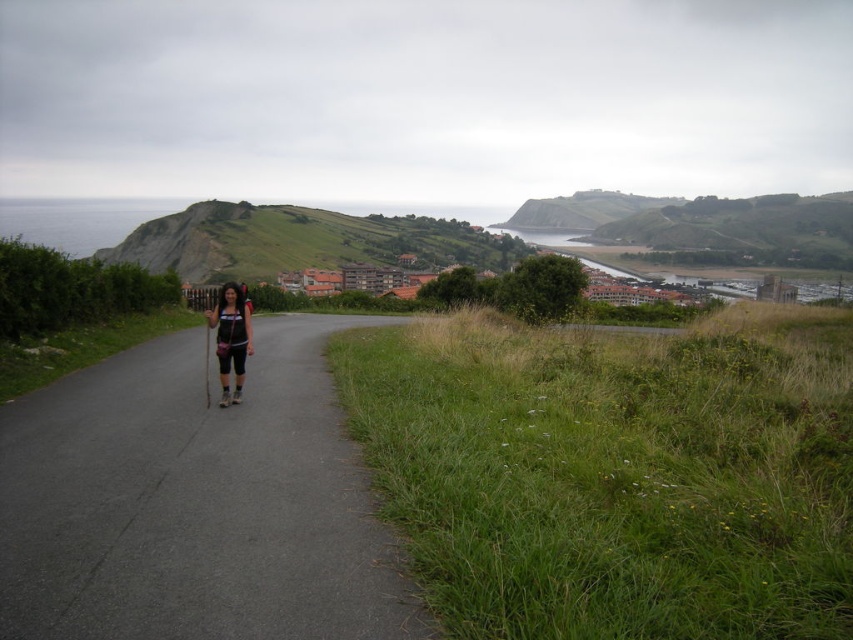
Which is above, green grassy hillside at center or green grassy hillside at upper center?

green grassy hillside at upper center is higher up.

Does green grassy hillside at center have a greater width compared to green grassy hillside at upper center?

Yes, green grassy hillside at center is wider than green grassy hillside at upper center.

Describe the element at coordinates (302, 241) in the screenshot. The width and height of the screenshot is (853, 640). I see `green grassy hillside at center` at that location.

You are a GUI agent. You are given a task and a screenshot of the screen. Output one action in this format:
    pyautogui.click(x=<x>, y=<y>)
    Task: Click on the green grassy hillside at center
    
    Given the screenshot: What is the action you would take?
    pyautogui.click(x=302, y=241)

Is asphalt road at center to the right of matte black shorts at center from the viewer's perspective?

Indeed, asphalt road at center is positioned on the right side of matte black shorts at center.

Between asphalt road at center and matte black shorts at center, which one is positioned lower?

asphalt road at center is lower down.

The image size is (853, 640). Find the location of `asphalt road at center`. asphalt road at center is located at coordinates (195, 502).

The width and height of the screenshot is (853, 640). I want to click on asphalt road at center, so click(195, 502).

Can you confirm if asphalt road at center is positioned to the right of green grassy hillside at upper center?

In fact, asphalt road at center is to the left of green grassy hillside at upper center.

Looking at this image, which of these two, asphalt road at center or green grassy hillside at upper center, stands shorter?

With less height is asphalt road at center.

You are a GUI agent. You are given a task and a screenshot of the screen. Output one action in this format:
    pyautogui.click(x=<x>, y=<y>)
    Task: Click on the asphalt road at center
    Image resolution: width=853 pixels, height=640 pixels.
    Given the screenshot: What is the action you would take?
    pyautogui.click(x=195, y=502)

Where is `asphalt road at center`? asphalt road at center is located at coordinates (195, 502).